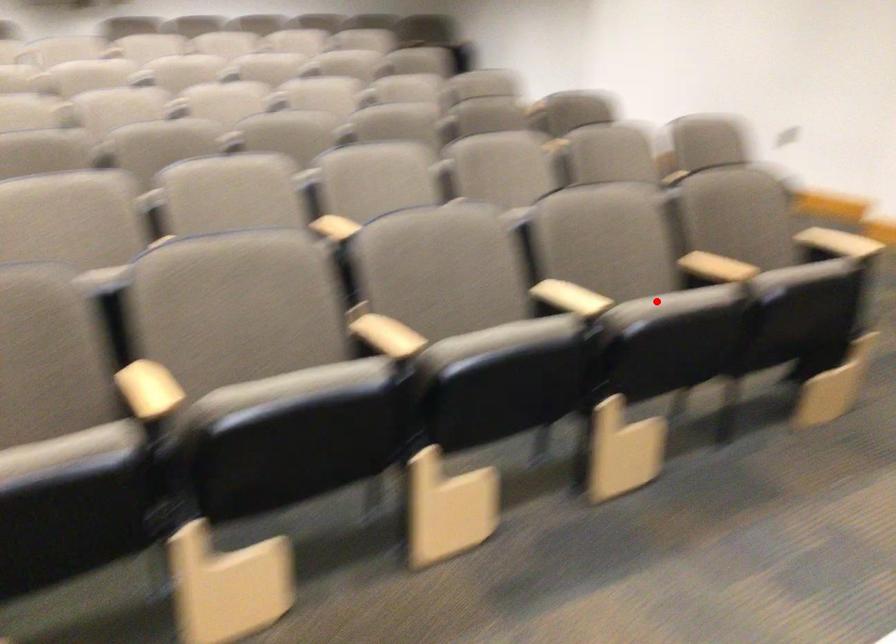
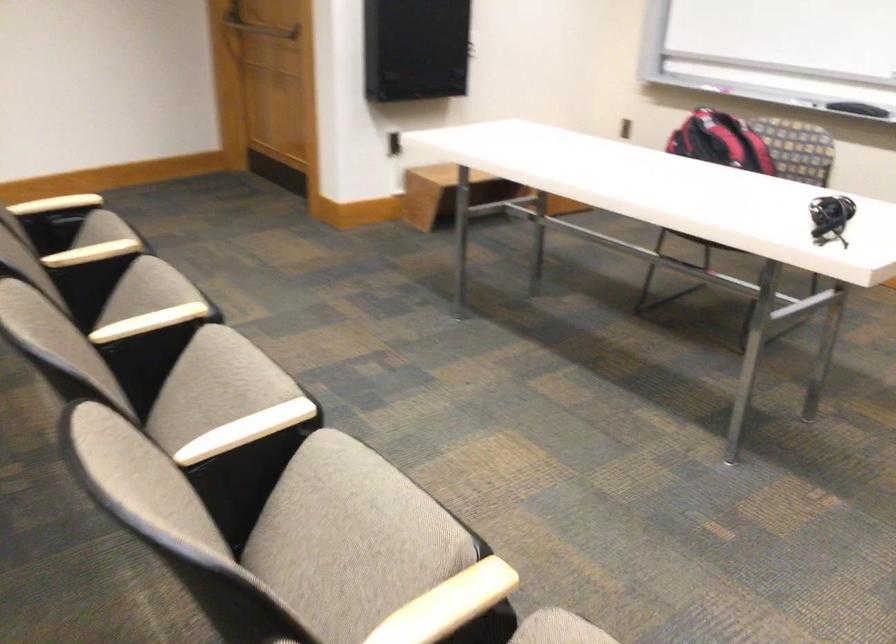
Locate, in the second image, the point that corresponds to the highlighted location in the first image.

(147, 290)